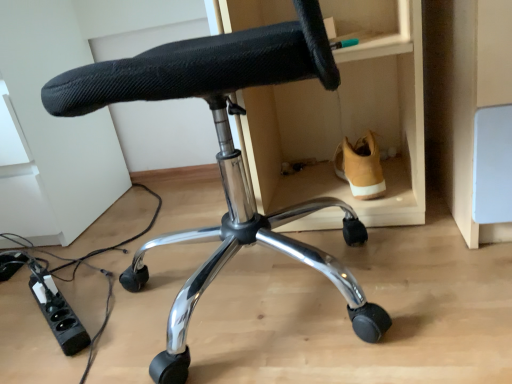
Question: Based on their sizes in the image, would you say tan suede shoe at lower right is bigger or smaller than black plastic power strip at lower left?

Choices:
 (A) big
 (B) small

Answer: (A)

Question: From the image's perspective, is tan suede shoe at lower right positioned above or below black plastic power strip at lower left?

Choices:
 (A) below
 (B) above

Answer: (B)

Question: Based on their relative distances, which object is nearer to the black mesh chair at center?

Choices:
 (A) black plastic power strip at lower left
 (B) tan suede shoe at lower right

Answer: (B)

Question: Which of these objects is positioned closest to the black plastic power strip at lower left?

Choices:
 (A) black mesh chair at center
 (B) tan suede shoe at lower right

Answer: (A)